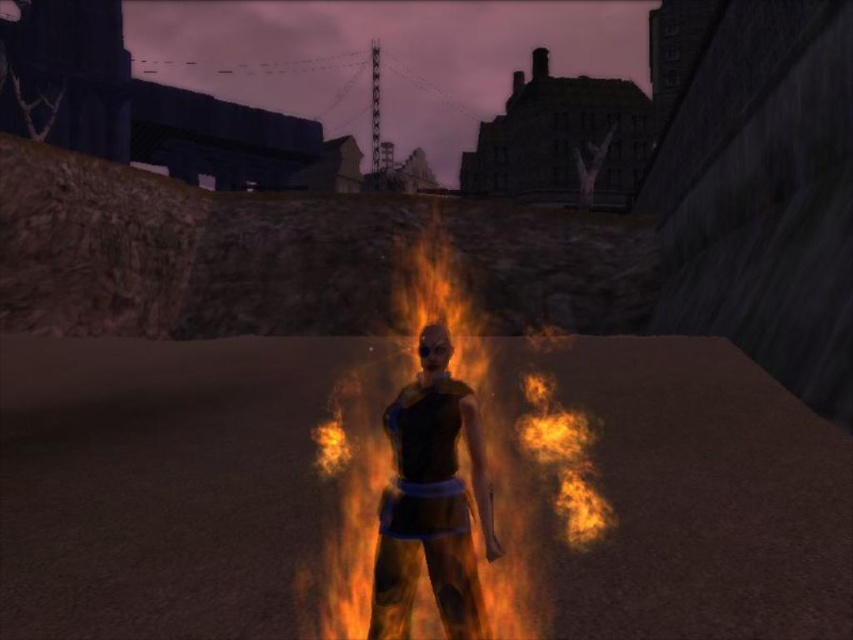
You are a character in the game trying to reach a glowing portal located to the left of the shiny black armor at center. Can you move to the portal without stepping into the flaming orange flames at center?

The flaming orange flames at center is to the right of shiny black armor at center. Since the portal is to the left of the shiny black armor at center, you can move to the portal without stepping into the flames.

You are a character in this game who needs to move past the shiny black armor at center without getting burned by the flaming orange flames at center. Based on their sizes, which object should you avoid getting too close to?

The flaming orange flames at center are taller than the shiny black armor at center, so you should avoid getting too close to the flaming orange flames at center to prevent getting burned.

You are a character in a video game trying to reach a checkpoint located behind the shiny black armor at center. The flaming orange flames at center are blocking your path. Can you safely jump over the flames to reach the armor?

The flaming orange flames at center is 3.65 feet away from shiny black armor at center. Since the distance between them is manageable for a jump, you can safely jump over the flames to reach the shiny black armor at center.